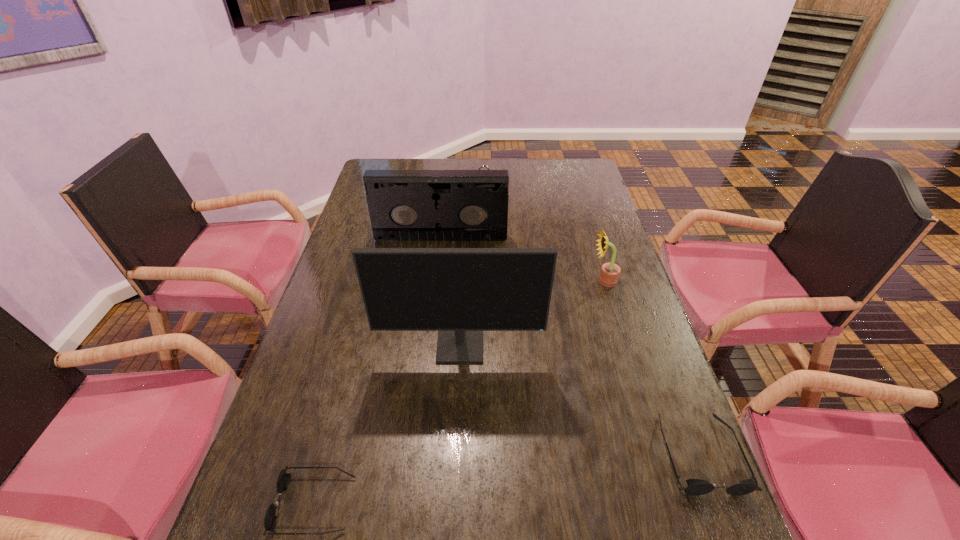
To ensure equal spacing by inserting another sunglasses among them, please point out a vacant spot for this new sunglasses. Please provide its 2D coordinates. Your answer should be formatted as a tuple, i.e. [(x, y)], where the tuple contains the x and y coordinates of a point satisfying the conditions above.

[(516, 477)]